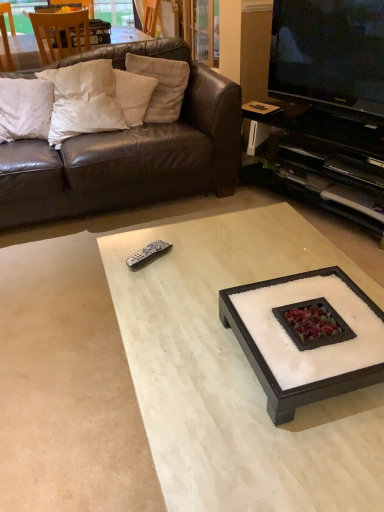
Question: Is white soft pillow at upper left, the second pillow viewed from the left, at the left side of wooden chair at upper left?

Choices:
 (A) no
 (B) yes

Answer: (A)

Question: Is wooden chair at upper left at the back of white soft pillow at upper left, which ranks as the 3th pillow in right-to-left order?

Choices:
 (A) yes
 (B) no

Answer: (A)

Question: Is the depth of white soft pillow at upper left, the second pillow viewed from the left, greater than that of wooden chair at upper left?

Choices:
 (A) no
 (B) yes

Answer: (A)

Question: Could you tell me if white soft pillow at upper left, which ranks as the 3th pillow in right-to-left order, is facing wooden chair at upper left?

Choices:
 (A) no
 (B) yes

Answer: (A)

Question: Is the depth of white soft pillow at upper left, the second pillow viewed from the left, less than that of wooden chair at upper left?

Choices:
 (A) no
 (B) yes

Answer: (B)

Question: Is white soft pillow at upper left, the second pillow viewed from the left, wider or thinner than white soft pillow at upper left, the fourth pillow viewed from the right?

Choices:
 (A) wide
 (B) thin

Answer: (A)

Question: Is point (61, 138) closer or farther from the camera than point (44, 117)?

Choices:
 (A) farther
 (B) closer

Answer: (B)

Question: Is white soft pillow at upper left, which ranks as the 3th pillow in right-to-left order, spatially inside white soft pillow at upper left, the fourth pillow viewed from the right, or outside of it?

Choices:
 (A) inside
 (B) outside

Answer: (B)

Question: From a real-world perspective, is white soft pillow at upper left, the second pillow viewed from the left, above or below white soft pillow at upper left, the fourth pillow viewed from the right?

Choices:
 (A) above
 (B) below

Answer: (A)

Question: From the image's perspective, is white soft pillow at upper left, the second pillow viewed from the left, positioned above or below white marble coffee table at center, acting as the first coffee table starting from the top?

Choices:
 (A) below
 (B) above

Answer: (B)

Question: In terms of height, does white soft pillow at upper left, which ranks as the 3th pillow in right-to-left order, look taller or shorter compared to white marble coffee table at center, which is the second coffee table in bottom-to-top order?

Choices:
 (A) tall
 (B) short

Answer: (A)

Question: In the image, is white soft pillow at upper left, which ranks as the 3th pillow in right-to-left order, positioned in front of or behind white marble coffee table at center, which is the second coffee table in bottom-to-top order?

Choices:
 (A) behind
 (B) front

Answer: (A)

Question: Is white soft pillow at upper left, which ranks as the 3th pillow in right-to-left order, inside the boundaries of white marble coffee table at center, which is the second coffee table in bottom-to-top order, or outside?

Choices:
 (A) inside
 (B) outside

Answer: (B)

Question: From a real-world perspective, relative to black glossy television at upper right, is white marble coffee table at center, which is the 1th coffee table in bottom-to-top order, vertically above or below?

Choices:
 (A) below
 (B) above

Answer: (A)

Question: Considering the positions of white marble coffee table at center, which is the 1th coffee table in bottom-to-top order, and black glossy television at upper right in the image, is white marble coffee table at center, which is the 1th coffee table in bottom-to-top order, bigger or smaller than black glossy television at upper right?

Choices:
 (A) small
 (B) big

Answer: (B)